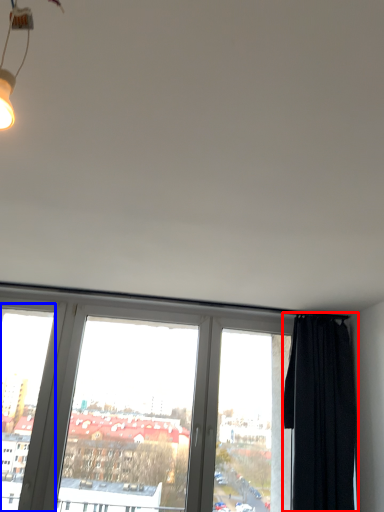
Question: Which point is closer to the camera, curtain (highlighted by a red box) or window frame (highlighted by a blue box)?

Choices:
 (A) curtain
 (B) window frame

Answer: (A)